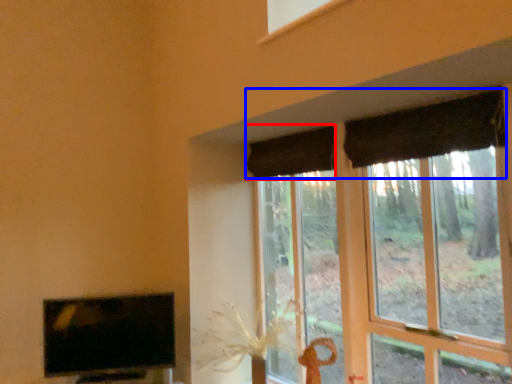
Question: Which point is closer to the camera, curtain (highlighted by a red box) or curtain (highlighted by a blue box)?

Choices:
 (A) curtain
 (B) curtain

Answer: (B)